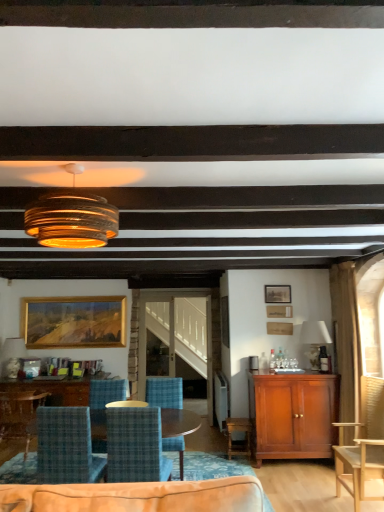
Based on the photo, what is the approximate width of light wood chair at right, the 5th chair from the left?

22.49 inches.

How much space does blue plaid fabric chair at center, arranged as the fourth chair when viewed from the left, occupy vertically?

blue plaid fabric chair at center, arranged as the fourth chair when viewed from the left, is 98.32 centimeters in height.

Identify the location of wooden table at lower left. (34, 407).

Find the location of a particular element. The image size is (384, 512). glass door on the left of white fabric lampshade at right, which ranks as the first lamp in right-to-left order is located at coordinates (168, 334).

Is clear glass door at center not close to white fabric lampshade at right, which ranks as the first lamp in right-to-left order?

clear glass door at center is far away from white fabric lampshade at right, which ranks as the first lamp in right-to-left order.

Is clear glass door at center situated inside white fabric lampshade at right, which is counted as the 2th lamp, starting from the back, or outside?

clear glass door at center is not inside white fabric lampshade at right, which is counted as the 2th lamp, starting from the back, it's outside.

Which is farther, (79, 386) or (28, 439)?

The point (79, 386) is more distant.

Is the surface of wooden table at lower left in direct contact with blue plaid chair at lower left, which is the 5th chair from right to left?

Yes, wooden table at lower left and blue plaid chair at lower left, which is the 5th chair from right to left, clearly make contact.

Considering their positions, is wooden table at lower left located in front of or behind blue plaid chair at lower left, which is the first chair from left to right?

wooden table at lower left is behind blue plaid chair at lower left, which is the first chair from left to right.

Who is taller, wooden table at lower left or blue plaid chair at lower left, which is the first chair from left to right?

blue plaid chair at lower left, which is the first chair from left to right, is taller.

Would you say gold wooden picture frame at upper left, the first picture frame in the bottom-to-top sequence, is inside or outside white fabric lampshade at right, which ranks as the 2th lamp in bottom-to-top order?

The correct answer is: outside.

Who is shorter, gold wooden picture frame at upper left, arranged as the second picture frame when viewed from the right, or white fabric lampshade at right, which ranks as the first lamp in right-to-left order?

white fabric lampshade at right, which ranks as the first lamp in right-to-left order.

Is there a large distance between gold wooden picture frame at upper left, which is counted as the 1th picture frame, starting from the back, and white fabric lampshade at right, positioned as the third lamp in left-to-right order?

Yes, gold wooden picture frame at upper left, which is counted as the 1th picture frame, starting from the back, is far from white fabric lampshade at right, positioned as the third lamp in left-to-right order.

Could you measure the distance between gold wooden picture frame at upper left, the first picture frame in the bottom-to-top sequence, and white fabric lampshade at right, marked as the 2th lamp in a top-to-bottom arrangement?

2.87 meters.

Are blue plaid chair at lower left, which is the 5th chair from right to left, and wooden table at lower left beside each other?

Absolutely, blue plaid chair at lower left, which is the 5th chair from right to left, is next to and touching wooden table at lower left.

From the image's perspective, does blue plaid chair at lower left, which is the 5th chair from right to left, appear lower than wooden table at lower left?

Incorrect, from the image's perspective, blue plaid chair at lower left, which is the 5th chair from right to left, is higher than wooden table at lower left.

Is blue plaid chair at lower left, which is the 5th chair from right to left, closer to camera compared to wooden table at lower left?

That is True.

Would you say blue plaid chair at lower left, which is the first chair from left to right, is to the left or to the right of wooden table at lower left in the picture?

From the image, it's evident that blue plaid chair at lower left, which is the first chair from left to right, is to the left of wooden table at lower left.

How far apart are light wood chair at right, the 5th chair from the left, and white fabric lampshade at right, positioned as the third lamp in left-to-right order?

A distance of 1.60 meters exists between light wood chair at right, the 5th chair from the left, and white fabric lampshade at right, positioned as the third lamp in left-to-right order.

Image resolution: width=384 pixels, height=512 pixels. I want to click on chair on the right side of white fabric lampshade at right, arranged as the 2th lamp when viewed from the front, so click(363, 444).

Considering the sizes of light wood chair at right, the 5th chair from the left, and white fabric lampshade at right, marked as the 2th lamp in a top-to-bottom arrangement, in the image, is light wood chair at right, the 5th chair from the left, wider or thinner than white fabric lampshade at right, marked as the 2th lamp in a top-to-bottom arrangement,?

In the image, light wood chair at right, the 5th chair from the left, appears to be wider than white fabric lampshade at right, marked as the 2th lamp in a top-to-bottom arrangement.

Is light wood chair at right, which ranks as the first chair in right-to-left order, facing away from white fabric lampshade at right, which ranks as the 2th lamp in bottom-to-top order?

light wood chair at right, which ranks as the first chair in right-to-left order, is not turned away from white fabric lampshade at right, which ranks as the 2th lamp in bottom-to-top order.

Is translucent amber glass pendant light at upper center, which is the third lamp in back-to-front order, to the left of wooden picture frame at upper right, the 2th picture frame in the left-to-right sequence, from the viewer's perspective?

Correct, you'll find translucent amber glass pendant light at upper center, which is the third lamp in back-to-front order, to the left of wooden picture frame at upper right, the 2th picture frame in the left-to-right sequence.

Is translucent amber glass pendant light at upper center, acting as the third lamp starting from the bottom, thinner than wooden picture frame at upper right, placed as the first picture frame when sorted from front to back?

Incorrect, the width of translucent amber glass pendant light at upper center, acting as the third lamp starting from the bottom, is not less than that of wooden picture frame at upper right, placed as the first picture frame when sorted from front to back.

Considering the points (53, 225) and (277, 286), which point is in front, point (53, 225) or point (277, 286)?

The point (53, 225) is in front.

Who is more distant, white fabric lampshade at right, which ranks as the 2th lamp in bottom-to-top order, or light wood chair at right, which ranks as the first chair in right-to-left order?

white fabric lampshade at right, which ranks as the 2th lamp in bottom-to-top order.

Does white fabric lampshade at right, which ranks as the first lamp in right-to-left order, have a lesser height compared to light wood chair at right, the 5th chair from the left?

Yes, white fabric lampshade at right, which ranks as the first lamp in right-to-left order, is shorter than light wood chair at right, the 5th chair from the left.

Does point (317, 339) come closer to viewer compared to point (382, 404)?

No, it is not.

Would you consider white fabric lampshade at right, which ranks as the 2th lamp in bottom-to-top order, to be distant from light wood chair at right, the 5th chair from the left?

Indeed, white fabric lampshade at right, which ranks as the 2th lamp in bottom-to-top order, is not near light wood chair at right, the 5th chair from the left.

You are a GUI agent. You are given a task and a screenshot of the screen. Output one action in this format:
    pyautogui.click(x=<x>, y=<y>)
    Task: Click on the 2nd lamp located above the clear glass door at center (from a real-world perspective)
    
    Given the screenshot: What is the action you would take?
    pyautogui.click(x=314, y=340)

The image size is (384, 512). I want to click on chair that is the 1st one when counting upward from the wooden table at lower left (from the image's perspective), so click(20, 413).

Estimate the real-world distances between objects in this image. Which object is further from matte glass lampshade at upper center, placed as the first lamp when sorted from bottom to top, white fabric lampshade at right, positioned as the third lamp in left-to-right order, or blue plaid fabric chair at center, arranged as the third chair when viewed from the right?

white fabric lampshade at right, positioned as the third lamp in left-to-right order, is further to matte glass lampshade at upper center, placed as the first lamp when sorted from bottom to top.

Considering their positions, is light wood chair at right, which ranks as the first chair in right-to-left order, positioned closer to blue plaid chair at lower left, which is the 5th chair from right to left, than matte glass lampshade at upper center, which appears as the third lamp when viewed from the top?

The object closer to blue plaid chair at lower left, which is the 5th chair from right to left, is matte glass lampshade at upper center, which appears as the third lamp when viewed from the top.

Looking at the image, which one is located further to light wood chair at right, the 5th chair from the left, blue plaid chair at lower left, placed as the 4th chair when sorted from right to left, or blue plaid fabric chair at center, which ranks as the 2th chair in right-to-left order?

blue plaid chair at lower left, placed as the 4th chair when sorted from right to left.

Estimate the real-world distances between objects in this image. Which object is closer to clear glass door at center, blue plaid fabric chair at center, arranged as the fourth chair when viewed from the left, or wooden table at lower left?

blue plaid fabric chair at center, arranged as the fourth chair when viewed from the left.

Considering their positions, is white fabric lampshade at right, arranged as the 2th lamp when viewed from the front, positioned closer to blue plaid chair at lower left, the 2th chair in the left-to-right sequence, than blue plaid fabric chair at center, arranged as the fourth chair when viewed from the left?

Based on the image, blue plaid fabric chair at center, arranged as the fourth chair when viewed from the left, appears to be nearer to blue plaid chair at lower left, the 2th chair in the left-to-right sequence.

When comparing their distances from white fabric lampshade at right, which ranks as the 2th lamp in bottom-to-top order, does wooden picture frame at upper right, placed as the first picture frame when sorted from front to back, or mahogany cabinet at right seem closer?

wooden picture frame at upper right, placed as the first picture frame when sorted from front to back, lies closer to white fabric lampshade at right, which ranks as the 2th lamp in bottom-to-top order, than the other object.

When comparing their distances from clear glass door at center, does wooden table at lower left or blue plaid fabric chair at center, which ranks as the 2th chair in right-to-left order, seem closer?

blue plaid fabric chair at center, which ranks as the 2th chair in right-to-left order, lies closer to clear glass door at center than the other object.

Estimate the real-world distances between objects in this image. Which object is further from blue plaid fabric chair at center, which appears as the third chair when viewed from the left, white fabric lampshade at right, marked as the 2th lamp in a top-to-bottom arrangement, or blue plaid chair at lower left, placed as the 4th chair when sorted from right to left?

white fabric lampshade at right, marked as the 2th lamp in a top-to-bottom arrangement, is positioned further to the anchor blue plaid fabric chair at center, which appears as the third chair when viewed from the left.

Identify the location of cabinetry between light wood chair at right, the 5th chair from the left, and wooden picture frame at upper right, arranged as the 2th picture frame when ordered from the bottom, from front to back. The image size is (384, 512). (293, 414).

Find the location of a particular element. This screenshot has height=512, width=384. cabinetry between wooden table at lower left and white fabric lampshade at right, which ranks as the 2th lamp in bottom-to-top order, from left to right is located at coordinates (293, 414).

Locate an element on the screen. This screenshot has height=512, width=384. chair between blue plaid fabric chair at center, arranged as the third chair when viewed from the right, and light wood chair at right, the 5th chair from the left, in the horizontal direction is located at coordinates (164, 392).

This screenshot has width=384, height=512. I want to click on cabinetry located between translucent amber glass pendant light at upper center, marked as the 1th lamp in a top-to-bottom arrangement, and blue plaid chair at lower left, which is the 5th chair from right to left, in the depth direction, so click(x=293, y=414).